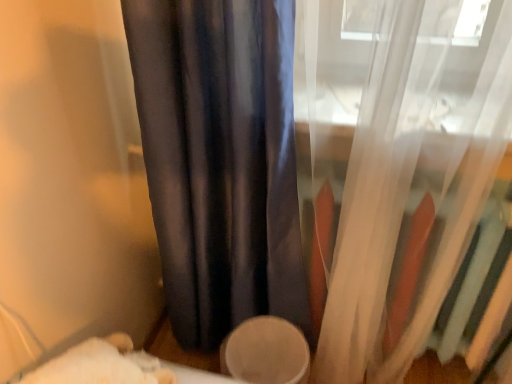
What do you see at coordinates (220, 160) in the screenshot?
I see `satin dark blue curtain at center` at bounding box center [220, 160].

You are a GUI agent. You are given a task and a screenshot of the screen. Output one action in this format:
    pyautogui.click(x=<x>, y=<y>)
    Task: Click on the satin dark blue curtain at center
    Image resolution: width=512 pixels, height=384 pixels.
    Given the screenshot: What is the action you would take?
    pyautogui.click(x=220, y=160)

At what (x,y) coordinates should I click in order to perform the action: click on satin dark blue curtain at center. Please return your answer as a coordinate pair (x, y). Looking at the image, I should click on (220, 160).